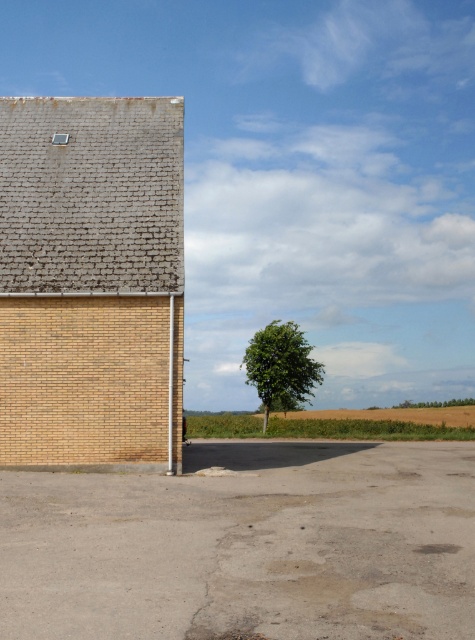
Question: Can you confirm if brick textured barn at upper left is positioned to the right of green leafy tree at center?

Choices:
 (A) yes
 (B) no

Answer: (B)

Question: Among these objects, which one is nearest to the camera?

Choices:
 (A) green leafy tree at center
 (B) brick textured barn at upper left

Answer: (B)

Question: Does brick textured barn at upper left appear on the right side of green leafy tree at center?

Choices:
 (A) yes
 (B) no

Answer: (B)

Question: Which object appears closest to the camera in this image?

Choices:
 (A) brick textured barn at upper left
 (B) green leafy tree at center

Answer: (A)

Question: Does brick textured barn at upper left have a lesser width compared to green leafy tree at center?

Choices:
 (A) no
 (B) yes

Answer: (B)